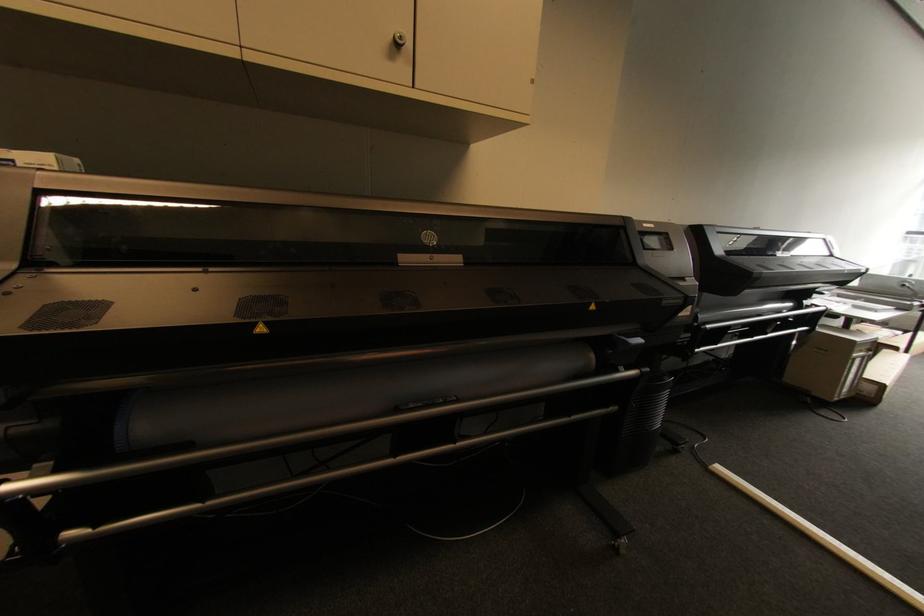
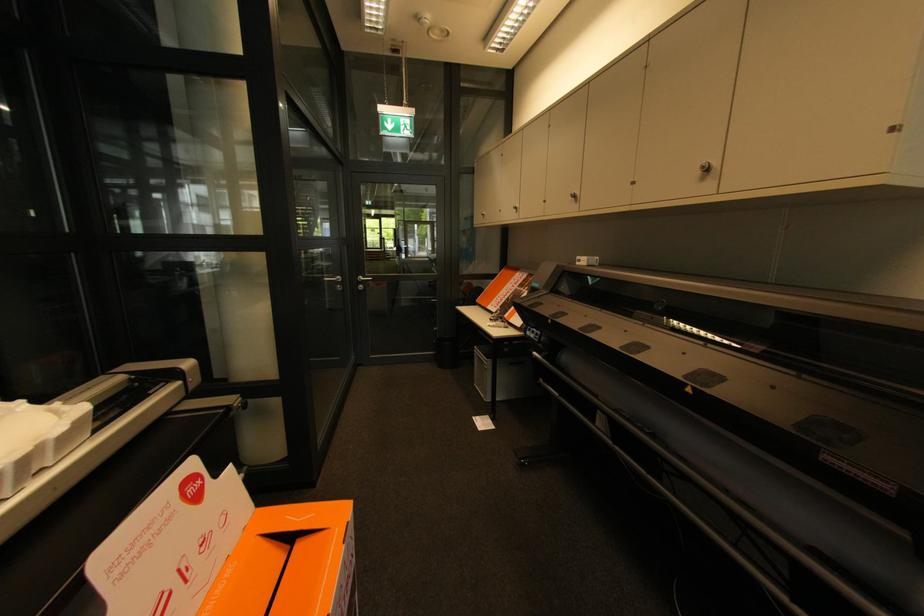
Where in the second image is the point corresponding to point (405, 38) from the first image?

(707, 168)